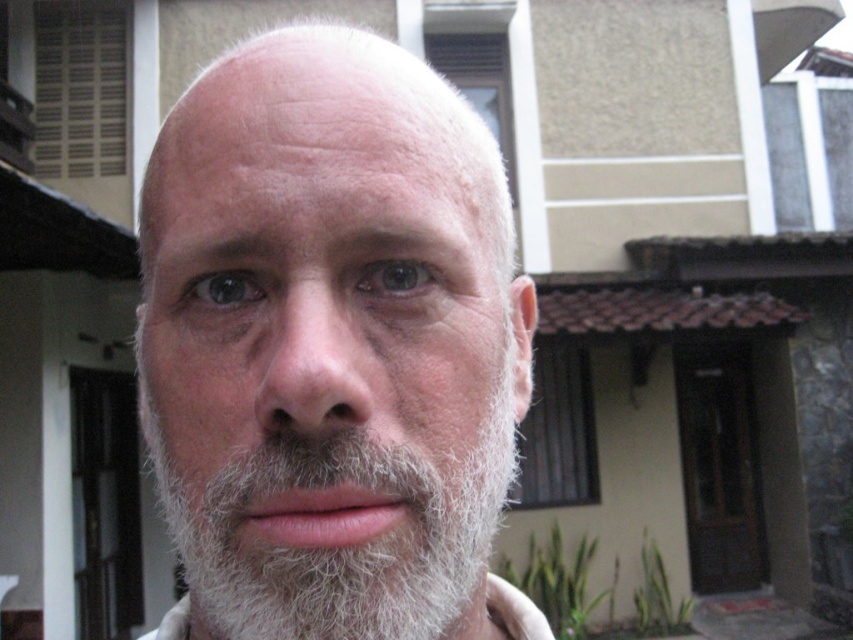
You are a barber trying to style the gray fuzzy beard at center and the white matte hair at center. Which one of these two has a shorter height?

The gray fuzzy beard at center has a lesser height compared to the white matte hair at center.

You are a photographer trying to capture the facial features of the person in the image. Since the gray fuzzy beard at center and the white matte hair at center are both at the center, which one is closer to the camera?

The gray fuzzy beard at center is in front of the white matte hair at center, so the gray fuzzy beard at center is closer to the camera.